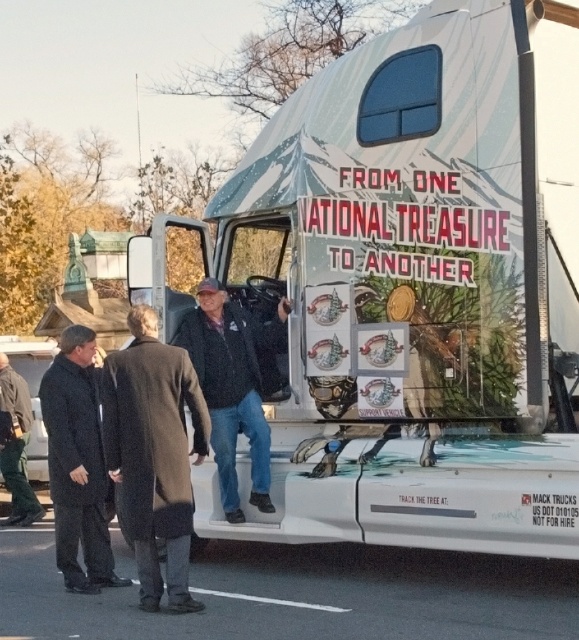
You are a photographer at the scene and need to capture a photo that includes both the dark gray wool coat at center and the dark brown leather jacket at lower left. Based on their positions, which clothing item will appear larger in the photo?

The dark gray wool coat at center will appear larger in the photo because it is taller than the dark brown leather jacket at lower left.

You are a photographer trying to capture a clear shot of the white matte truck at center and the dark brown leather jacket at lower left. Since you want both subjects to be fully visible in the frame, which subject should you position closer to the camera to avoid cropping?

The white matte truck at center is taller than the dark brown leather jacket at lower left. To ensure both are fully visible, position the white matte truck at center closer to the camera so its height doesn